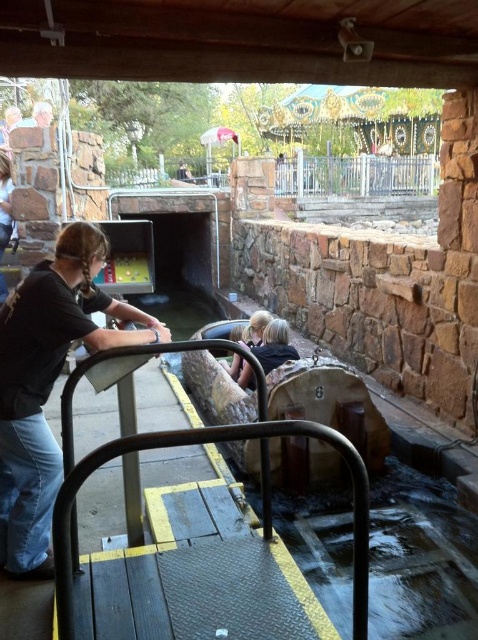
You are standing at the center of the water ride boat in the theme park scene. Looking towards the left side of the boat, you notice a specific point marked at coordinates point [49,384]. What object does this point correspond to?

The point [49,384] corresponds to the black matte shirt at left.

You are standing at the starting point of the water ride and want to reach the exit. The exit is located at point (31, 115). However, there is an obstacle at point (72, 260). Which point should you avoid to safely reach the exit?

You should avoid point 0.409, 0.065 because it is in front of the obstacle at point (72, 260), so you need to go around it to reach the exit safely.